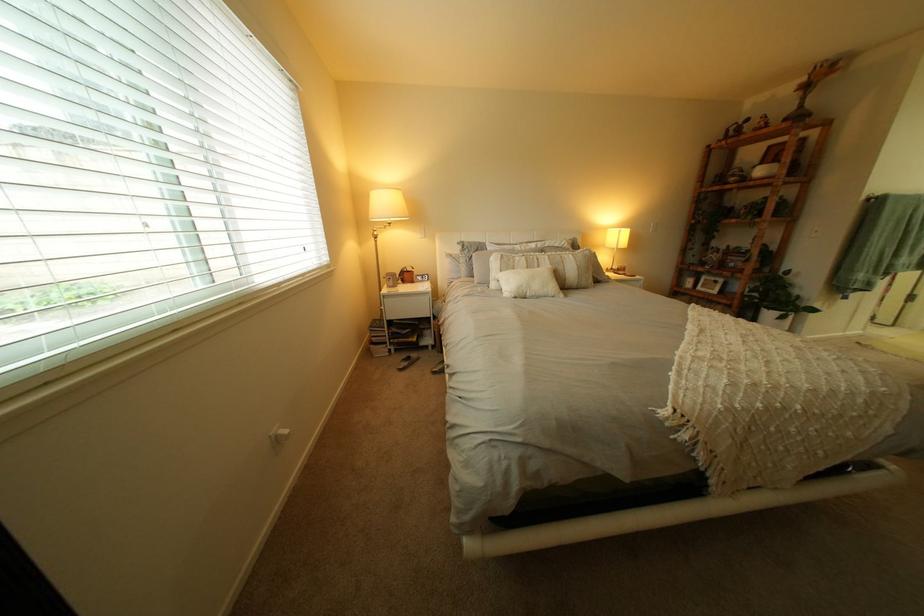
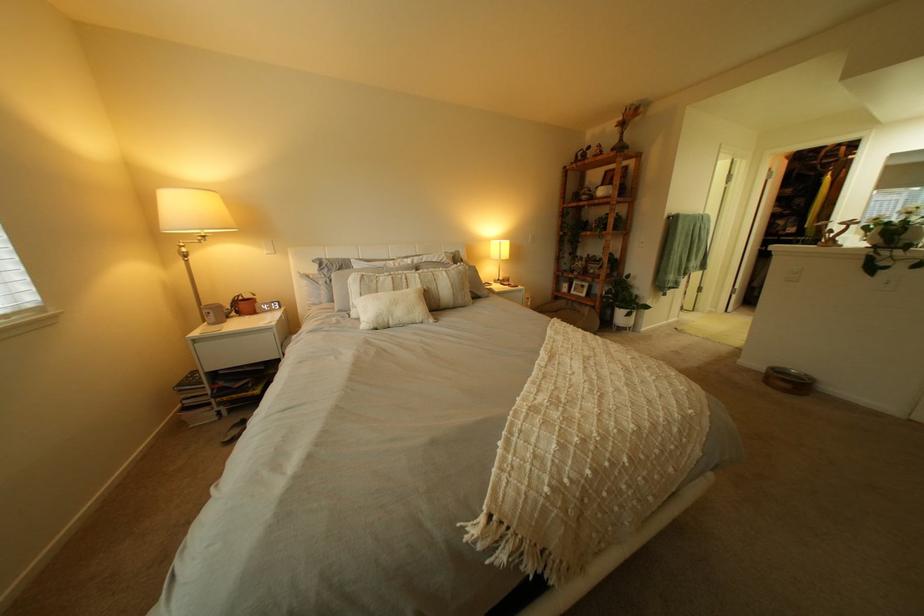
In the second image, find the point that corresponds to pixel 564 264 in the first image.

(434, 283)